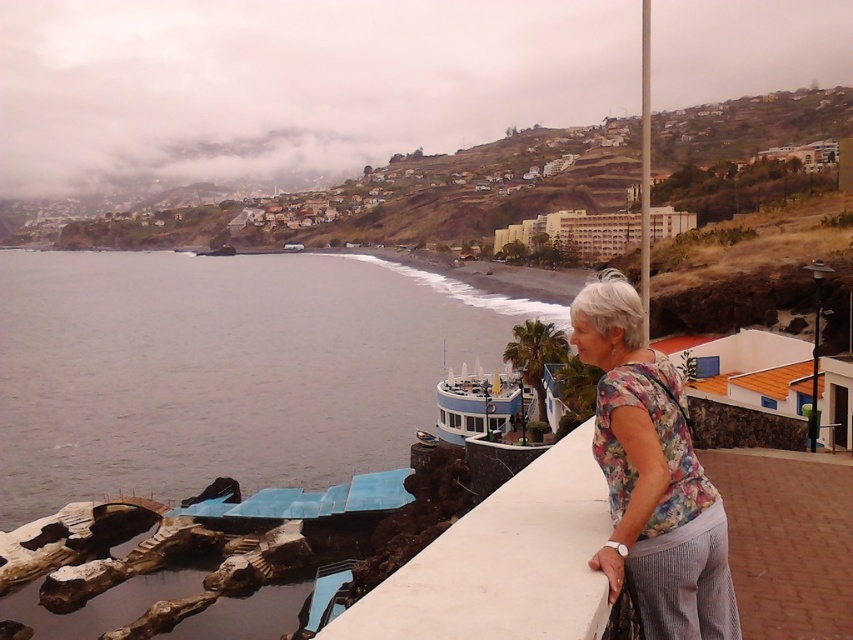
Can you confirm if white concrete ledge at lower right is thinner than floral fabric blouse at right?

No.

Consider the image. Can you confirm if white concrete ledge at lower right is shorter than floral fabric blouse at right?

Yes, white concrete ledge at lower right is shorter than floral fabric blouse at right.

What are the coordinates of `white concrete ledge at lower right` in the screenshot? It's located at (503, 563).

Is point (71, 316) closer to camera compared to point (358, 608)?

No.

Is gray water at lower left above white concrete ledge at lower right?

Correct, gray water at lower left is located above white concrete ledge at lower right.

Is point (18, 522) less distant than point (480, 572)?

No, it is behind (480, 572).

Where is `gray water at lower left`? This screenshot has height=640, width=853. gray water at lower left is located at coordinates (222, 369).

Is gray water at lower left above floral fabric blouse at right?

Indeed, gray water at lower left is positioned over floral fabric blouse at right.

Measure the distance between gray water at lower left and camera.

gray water at lower left and camera are 198.41 feet apart from each other.

The width and height of the screenshot is (853, 640). Identify the location of gray water at lower left. (222, 369).